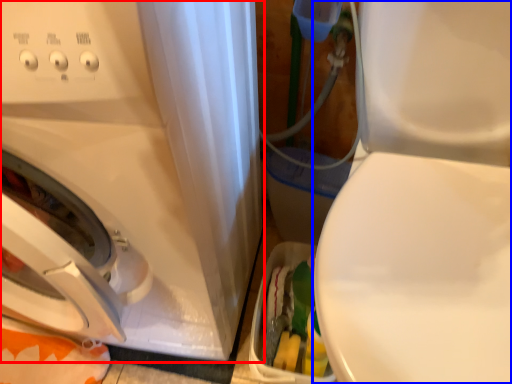
Question: Which object is closer to the camera taking this photo, washing machine (highlighted by a red box) or machine (highlighted by a blue box)?

Choices:
 (A) washing machine
 (B) machine

Answer: (B)